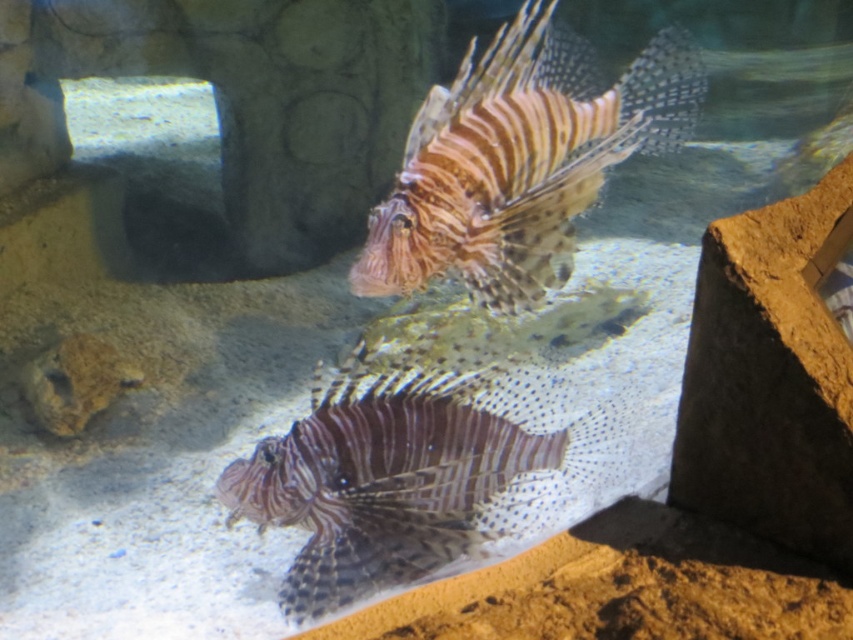
You are an aquarium keeper who wants to place a new decorative coral that is 10 cm tall. You see the spotted purple fish at center and the brown striped fish at center. Which fish can comfortably swim above the coral without touching its top?

The brown striped fish at center can comfortably swim above the coral without touching its top since it has a greater height than the spotted purple fish at center, which is shorter. The coral is 10 cm tall, so the taller fish has enough clearance.

You are an underwater explorer observing the aquarium. You notice two fish at the center of the tank. Which one is closer to you, the spotted purple fish at center or the brown striped fish at center?

The spotted purple fish at center is closer to you because it is further to the viewer than the brown striped fish at center.